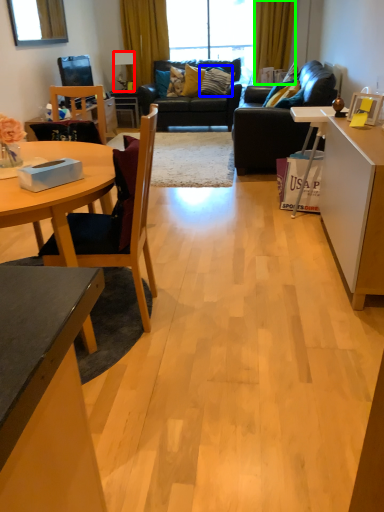
Question: Which object is the closest to the lamp (highlighted by a red box)? Choose among these: pillow (highlighted by a blue box) or curtain (highlighted by a green box).

Choices:
 (A) pillow
 (B) curtain

Answer: (A)